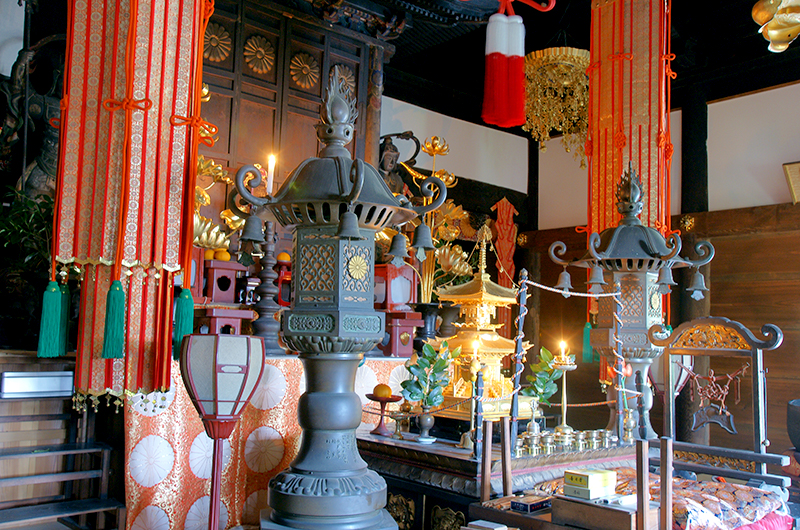
What are the coordinates of `textile` in the screenshot? It's located at (732, 501).